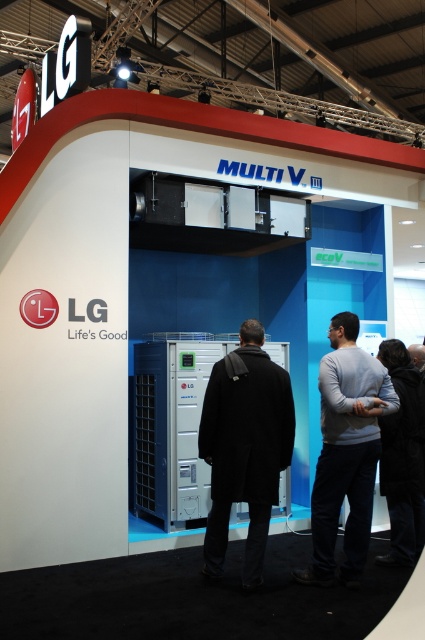
Who is positioned more to the left, black matte jacket at center or gray sweater at center?

black matte jacket at center

Who is lower down, black matte jacket at center or gray sweater at center?

Positioned lower is gray sweater at center.

Image resolution: width=425 pixels, height=640 pixels. What are the coordinates of `black matte jacket at center` in the screenshot? It's located at (244, 448).

Between point (353, 506) and point (413, 435), which one is positioned behind?

The point (413, 435) is behind.

Between gray sweater at center and black fabric jacket at lower right, which one is positioned lower?

black fabric jacket at lower right

Does point (365, 488) lie behind point (380, 358)?

No, it is in front of (380, 358).

This screenshot has width=425, height=640. Find the location of `gray sweater at center`. gray sweater at center is located at coordinates (345, 452).

Who is more forward, (229, 355) or (408, 410)?

Positioned in front is point (229, 355).

Is black matte jacket at center above black fabric jacket at lower right?

Yes, black matte jacket at center is above black fabric jacket at lower right.

Does point (215, 515) come behind point (422, 390)?

No, it is in front of (422, 390).

Find the location of a particular element. This screenshot has height=640, width=425. black matte jacket at center is located at coordinates (244, 448).